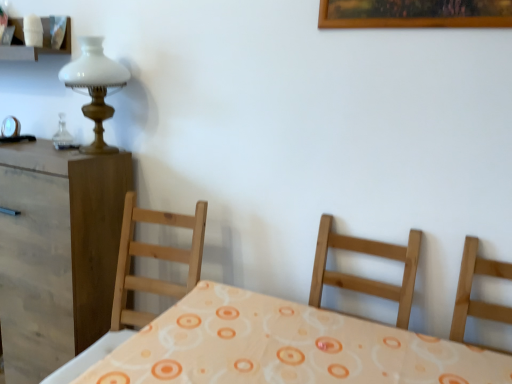
Question: From a real-world perspective, does white glass lamp at upper left sit lower than white matte shelf at upper left?

Choices:
 (A) no
 (B) yes

Answer: (B)

Question: Are white glass lamp at upper left and white matte shelf at upper left making contact?

Choices:
 (A) no
 (B) yes

Answer: (A)

Question: Is white glass lamp at upper left closer to the viewer compared to white matte shelf at upper left?

Choices:
 (A) yes
 (B) no

Answer: (A)

Question: Is white matte shelf at upper left inside white glass lamp at upper left?

Choices:
 (A) no
 (B) yes

Answer: (A)

Question: Is white glass lamp at upper left not within white matte shelf at upper left?

Choices:
 (A) no
 (B) yes

Answer: (B)

Question: Is white matte shelf at upper left in front of or behind white glass lamp at upper left in the image?

Choices:
 (A) behind
 (B) front

Answer: (A)

Question: Is white matte shelf at upper left to the left or to the right of white glass lamp at upper left in the image?

Choices:
 (A) right
 (B) left

Answer: (B)

Question: Do you think white matte shelf at upper left is within white glass lamp at upper left, or outside of it?

Choices:
 (A) outside
 (B) inside

Answer: (A)

Question: Based on their sizes in the image, would you say white matte shelf at upper left is bigger or smaller than white glass lamp at upper left?

Choices:
 (A) small
 (B) big

Answer: (A)

Question: Does point (80, 148) appear closer or farther from the camera than point (54, 52)?

Choices:
 (A) farther
 (B) closer

Answer: (A)

Question: From a real-world perspective, is white glass lamp at upper left positioned above or below white matte shelf at upper left?

Choices:
 (A) below
 (B) above

Answer: (A)

Question: From the image's perspective, is white glass lamp at upper left located above or below white matte shelf at upper left?

Choices:
 (A) below
 (B) above

Answer: (A)

Question: Is white glass lamp at upper left taller or shorter than white matte shelf at upper left?

Choices:
 (A) short
 (B) tall

Answer: (B)

Question: Is white glass lamp at upper left inside the boundaries of brown wood nightstand at left, or outside?

Choices:
 (A) outside
 (B) inside

Answer: (A)

Question: From the image's perspective, is white glass lamp at upper left located above or below brown wood nightstand at left?

Choices:
 (A) below
 (B) above

Answer: (B)